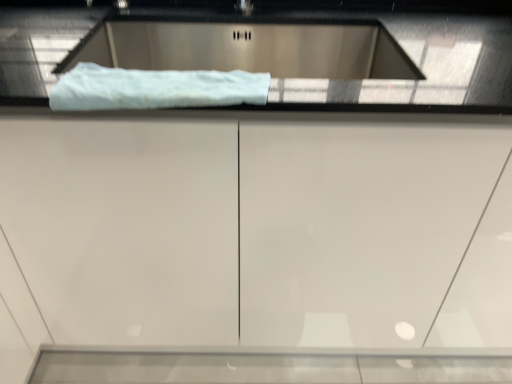
Find the location of `white glossy cabinet at center`. white glossy cabinet at center is located at coordinates (247, 227).

The width and height of the screenshot is (512, 384). Describe the element at coordinates (154, 89) in the screenshot. I see `white fluffy towel at upper center` at that location.

In order to click on white glossy cabinet at center in this screenshot , I will do (247, 227).

From the picture: From the image's perspective, is white fluffy towel at upper center on satin silver sink at upper center?

No, from the image's perspective, white fluffy towel at upper center is not over satin silver sink at upper center.

How distant is white fluffy towel at upper center from satin silver sink at upper center?

white fluffy towel at upper center and satin silver sink at upper center are 13.14 inches apart.

Can you confirm if white fluffy towel at upper center is thinner than satin silver sink at upper center?

Indeed, white fluffy towel at upper center has a lesser width compared to satin silver sink at upper center.

Is white glossy cabinet at center looking in the opposite direction of satin silver sink at upper center?

Absolutely, white glossy cabinet at center is directed away from satin silver sink at upper center.

Is white glossy cabinet at center inside or outside of satin silver sink at upper center?

white glossy cabinet at center is spatially situated outside satin silver sink at upper center.

How much distance is there between white glossy cabinet at center and satin silver sink at upper center?

white glossy cabinet at center is 44.06 centimeters from satin silver sink at upper center.

Find the location of `sink above the white glossy cabinet at center (from a real-world perspective)`. sink above the white glossy cabinet at center (from a real-world perspective) is located at coordinates (248, 47).

Which object is further away from the camera, satin silver sink at upper center or white fluffy towel at upper center?

satin silver sink at upper center is further away from the camera.

Are satin silver sink at upper center and white fluffy towel at upper center beside each other?

No, satin silver sink at upper center is not in contact with white fluffy towel at upper center.

Image resolution: width=512 pixels, height=384 pixels. Find the location of `material on the left of satin silver sink at upper center`. material on the left of satin silver sink at upper center is located at coordinates (154, 89).

Which is more to the left, satin silver sink at upper center or white fluffy towel at upper center?

From the viewer's perspective, white fluffy towel at upper center appears more on the left side.

From a real-world perspective, which object rests below the other?

white glossy cabinet at center, from a real-world perspective.

Is white glossy cabinet at center located within satin silver sink at upper center?

No, white glossy cabinet at center is located outside of satin silver sink at upper center.

From the image's perspective, would you say satin silver sink at upper center is shown under white glossy cabinet at center?

No, from the image's perspective, satin silver sink at upper center is not below white glossy cabinet at center.

Can you confirm if satin silver sink at upper center is taller than white glossy cabinet at center?

No, satin silver sink at upper center is not taller than white glossy cabinet at center.

From a real-world perspective, is white fluffy towel at upper center located higher than white glossy cabinet at center?

Yes, from a real-world perspective, white fluffy towel at upper center is over white glossy cabinet at center

Is white fluffy towel at upper center far away from white glossy cabinet at center?

Actually, white fluffy towel at upper center and white glossy cabinet at center are a little close together.

Is white fluffy towel at upper center at the left side of white glossy cabinet at center?

Indeed, white fluffy towel at upper center is positioned on the left side of white glossy cabinet at center.

From the image's perspective, is white glossy cabinet at center on top of white fluffy towel at upper center?

Actually, white glossy cabinet at center appears below white fluffy towel at upper center in the image.

From a real-world perspective, is white glossy cabinet at center under white fluffy towel at upper center?

Yes, from a real-world perspective, white glossy cabinet at center is under white fluffy towel at upper center.

Can you confirm if white glossy cabinet at center is taller than white fluffy towel at upper center?

Yes, white glossy cabinet at center is taller than white fluffy towel at upper center.

I want to click on material that appears in front of the satin silver sink at upper center, so click(x=154, y=89).

I want to click on sink that is above the white glossy cabinet at center (from the image's perspective), so click(248, 47).

In the scene shown: Which object lies further to the anchor point white fluffy towel at upper center, satin silver sink at upper center or white glossy cabinet at center?

The object further to white fluffy towel at upper center is satin silver sink at upper center.

When comparing their distances from white glossy cabinet at center, does satin silver sink at upper center or white fluffy towel at upper center seem closer?

white fluffy towel at upper center is positioned closer to the anchor white glossy cabinet at center.

Considering their positions, is white glossy cabinet at center positioned closer to white fluffy towel at upper center than satin silver sink at upper center?

white glossy cabinet at center lies closer to white fluffy towel at upper center than the other object.

Which object lies nearer to the anchor point satin silver sink at upper center, white glossy cabinet at center or white fluffy towel at upper center?

white fluffy towel at upper center is closer to satin silver sink at upper center.

Estimate the real-world distances between objects in this image. Which object is closer to satin silver sink at upper center, white fluffy towel at upper center or white glossy cabinet at center?

white fluffy towel at upper center is positioned closer to the anchor satin silver sink at upper center.

Looking at the image, which one is located further to white glossy cabinet at center, white fluffy towel at upper center or satin silver sink at upper center?

Among the two, satin silver sink at upper center is located further to white glossy cabinet at center.

Locate an element on the screen. The height and width of the screenshot is (384, 512). material between satin silver sink at upper center and white glossy cabinet at center from top to bottom is located at coordinates (154, 89).